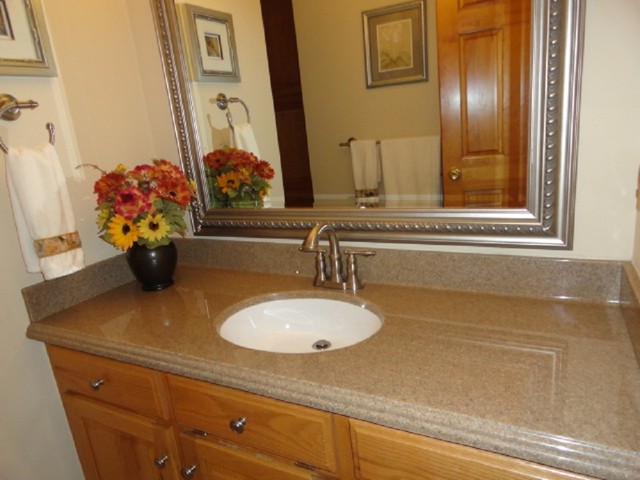
At what (x,y) coordinates should I click in order to perform the action: click on knobs. Please return your answer as a coordinate pair (x, y). The image size is (640, 480). Looking at the image, I should click on (360, 254), (316, 253).